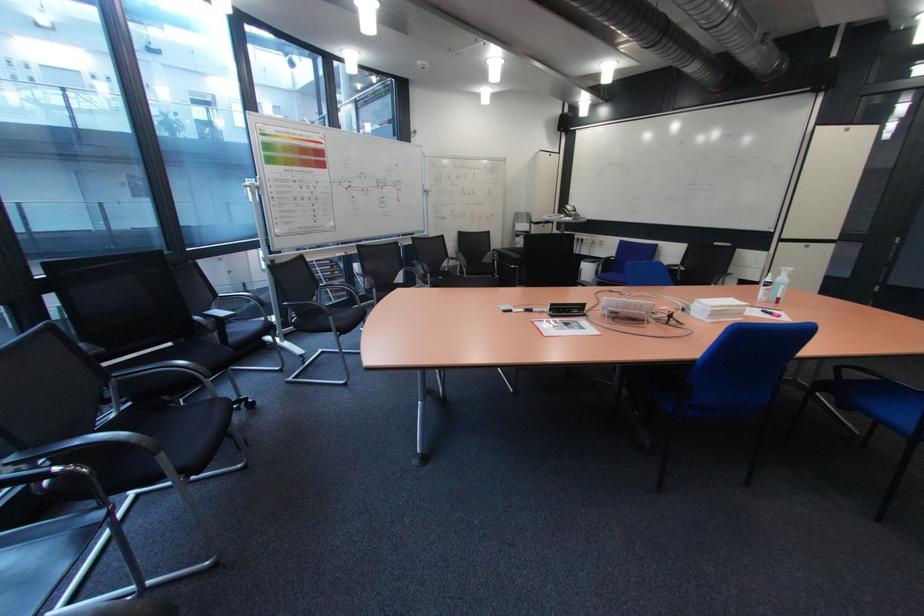
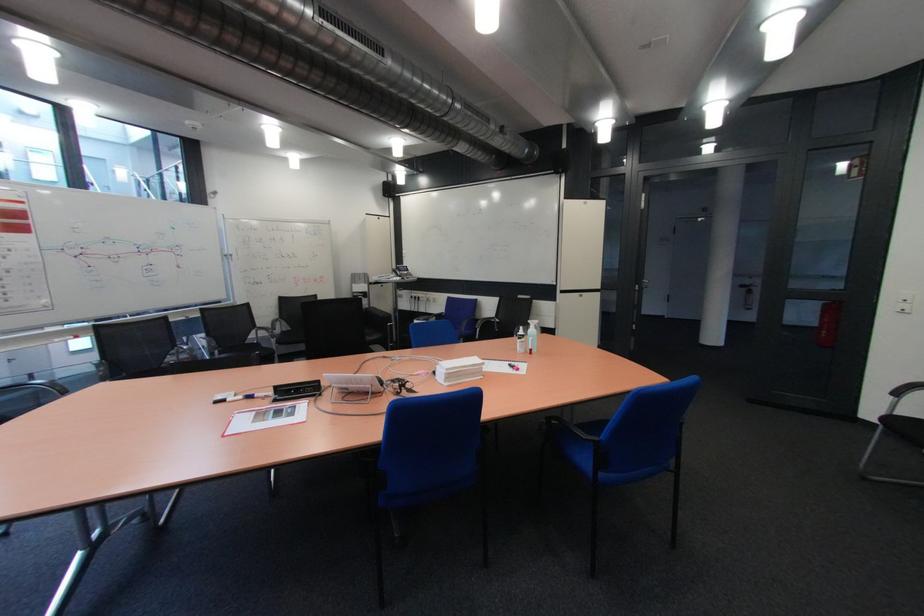
Question: Based on the continuous images, in which direction is the camera rotating? Reply with the corresponding letter.

Choices:
 (A) Left
 (B) Right
 (C) Up
 (D) Down

Answer: (B)